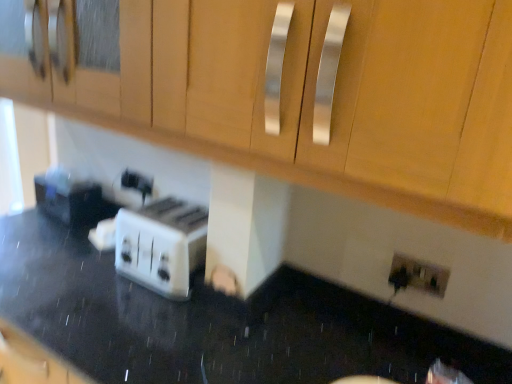
You are a GUI agent. You are given a task and a screenshot of the screen. Output one action in this format:
    pyautogui.click(x=<x>, y=<y>)
    Task: Click on the vacant region above white glossy toaster at lower left (from a real-world perspective)
    This screenshot has width=512, height=384.
    Given the screenshot: What is the action you would take?
    [200, 326]